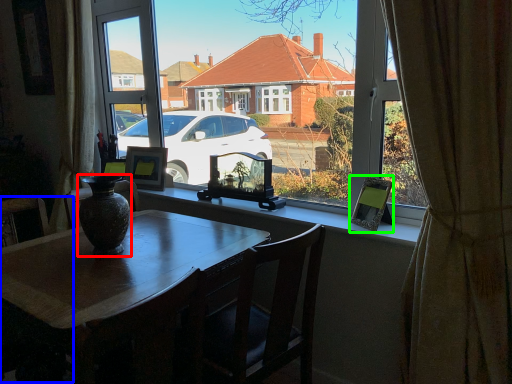
Question: Which object is positioned closest to vase (highlighted by a red box)? Select from armchair (highlighted by a blue box) and picture frame (highlighted by a green box).

Choices:
 (A) armchair
 (B) picture frame

Answer: (B)